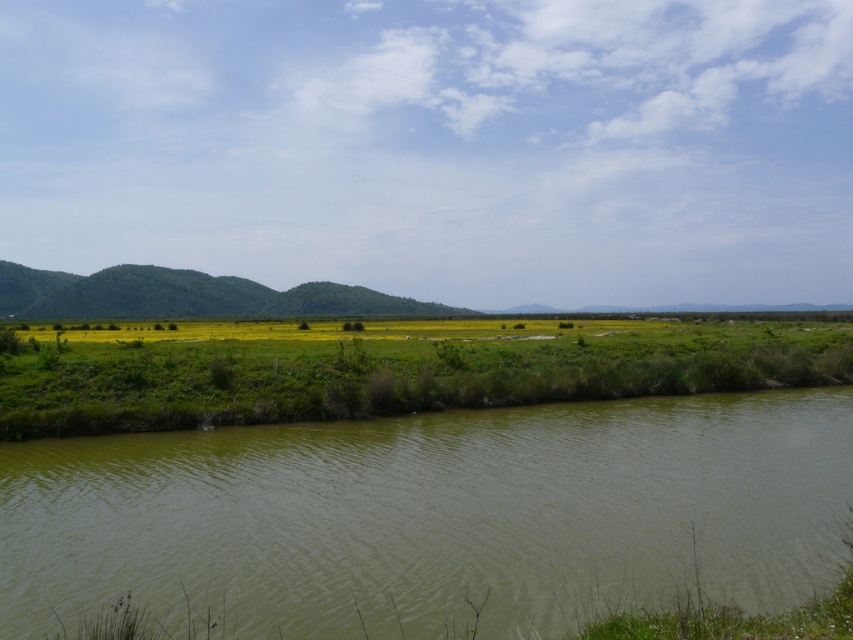
You are a hiker who wants to cross from the green muddy water at lower left to the green grassy wetland at center. Is the path directly between them accessible?

The green muddy water at lower left is located below green grassy wetland at center, so the path between them is accessible.

You are standing at the edge of the green muddy water at lower left and want to walk to the green grassy hill at center. Which direction should you head to reach the hill?

You should head towards the center direction because the green grassy hill at center is located in that direction from the green muddy water at lower left.

Based on the photo, you are standing on the path and want to cross to the yellow flowers in the background. The green grassy wetland at center is muddy and slippery. Can you safely walk around the green muddy water at lower left to reach the yellow flowers?

The green muddy water at lower left is in front of the green grassy wetland at center, so you can walk around it to reach the yellow flowers in the background.